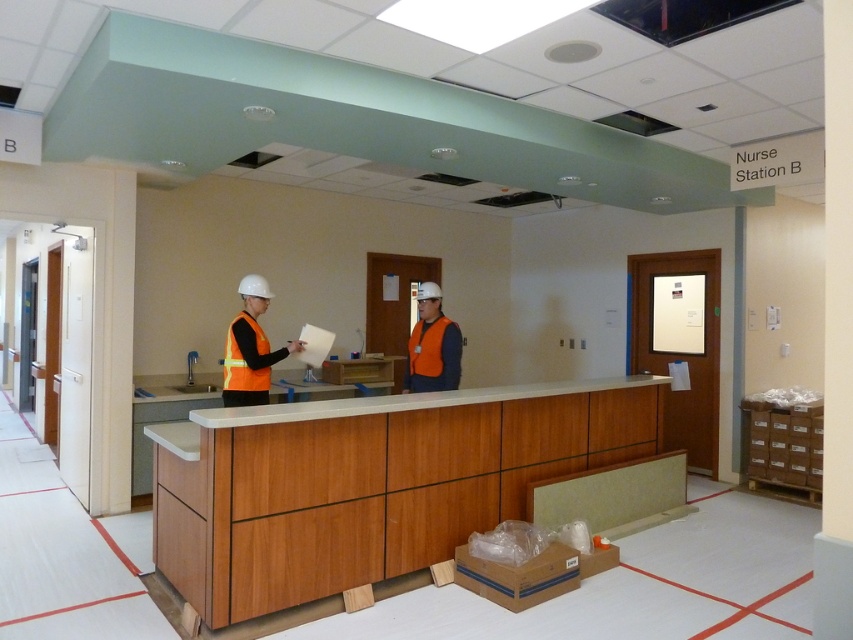
Based on the photo, you are a construction worker who needs to locate your orange reflective vest at center. Where exactly is it positioned in the room relative to the nurse station desk?

The orange reflective vest at center is located at point coordinates of 0.545 on the x axis and 0.294 on the y axis.

You are an inspector checking the construction site. You need to ensure that the orange reflective vest at center is visible from the entrance. Since the wooden cabinet at center is in the way, will its width block the vest? Please explain based on their sizes.

The wooden cabinet at center is wider than the orange reflective vest at center. Since the cabinet is wider, it could potentially block the view of the vest depending on their exact positions, but the description only states the cabinet is wider, not its depth or distance from the vest. Without additional spatial details, we can only confirm the cabinet is wider, which might affect visibility but cannot be certain without more information.

You are an inspector checking the construction site. You need to store your tools temporarily. Which object, the wooden cabinet at center or the orange reflective vest at center, would be more suitable for storing your tools based on their sizes?

The wooden cabinet at center has a larger size compared to the orange reflective vest at center, so the wooden cabinet at center is more suitable for storing tools.